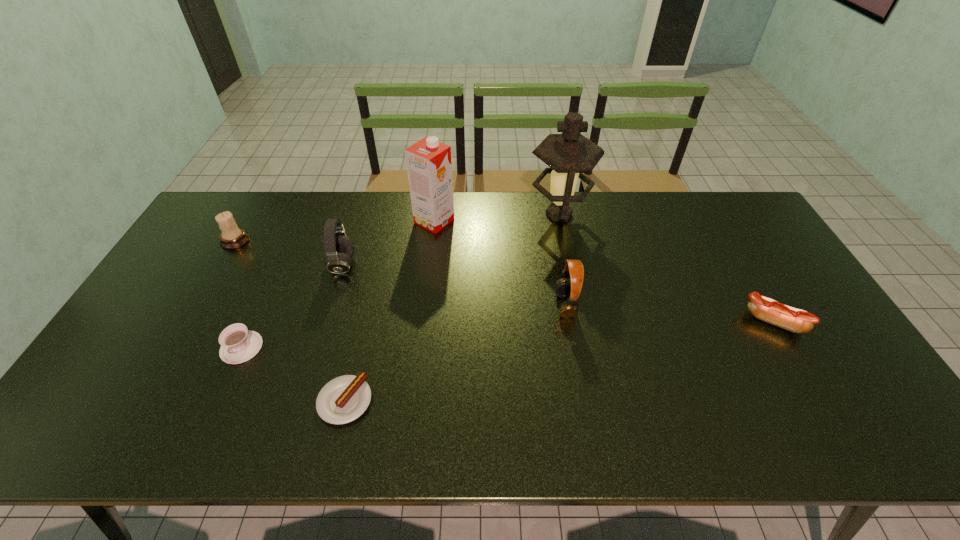
The image size is (960, 540). What are the coordinates of `object present at the far left corner` in the screenshot? It's located at (232, 237).

Where is `free space at the far edge`? free space at the far edge is located at coordinates (622, 212).

In the image, there is a desktop. Where is `vacant space at the near edge`? This screenshot has height=540, width=960. vacant space at the near edge is located at coordinates (780, 424).

Locate an element on the screen. The width and height of the screenshot is (960, 540). blank space at the left edge of the desktop is located at coordinates (177, 319).

Where is `vacant region at the right edge`? The width and height of the screenshot is (960, 540). vacant region at the right edge is located at coordinates (807, 379).

At what (x,y) coordinates should I click in order to perform the action: click on vacant point located between the fourth farthest object and the nearest object. Please return your answer as a coordinate pair (x, y). Looking at the image, I should click on (344, 333).

At what (x,y) coordinates should I click in order to perform the action: click on free area in between the nearer headset and the carton. Please return your answer as a coordinate pair (x, y). Looking at the image, I should click on (500, 263).

Where is `free area in between the oil lamp and the right headset`? Image resolution: width=960 pixels, height=540 pixels. free area in between the oil lamp and the right headset is located at coordinates (562, 260).

Where is `empty space that is in between the farther headset and the left sausage`? This screenshot has width=960, height=540. empty space that is in between the farther headset and the left sausage is located at coordinates (344, 333).

You are a GUI agent. You are given a task and a screenshot of the screen. Output one action in this format:
    pyautogui.click(x=<x>, y=<y>)
    Task: Click on the free space that is in between the leftmost object and the right sausage
    The height and width of the screenshot is (540, 960).
    Given the screenshot: What is the action you would take?
    [x=504, y=281]